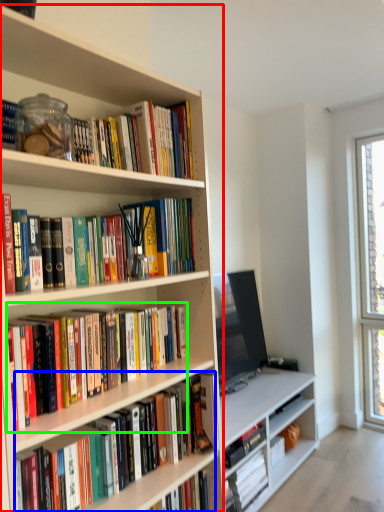
Question: Based on their relative distances, which object is farther from bookcase (highlighted by a red box)? Choose from book (highlighted by a blue box) and book (highlighted by a green box).

Choices:
 (A) book
 (B) book

Answer: (A)